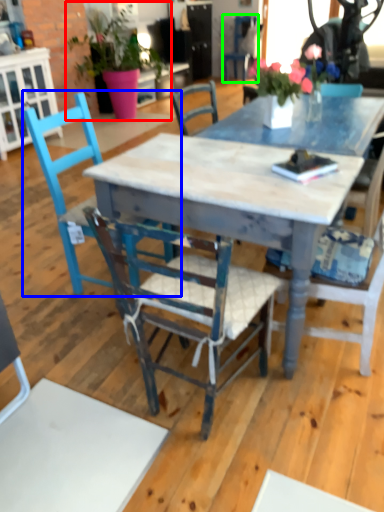
Question: Estimate the real-world distances between objects in this image. Which object is closer to houseplant (highlighted by a red box), chair (highlighted by a blue box) or chair (highlighted by a green box)?

Choices:
 (A) chair
 (B) chair

Answer: (B)